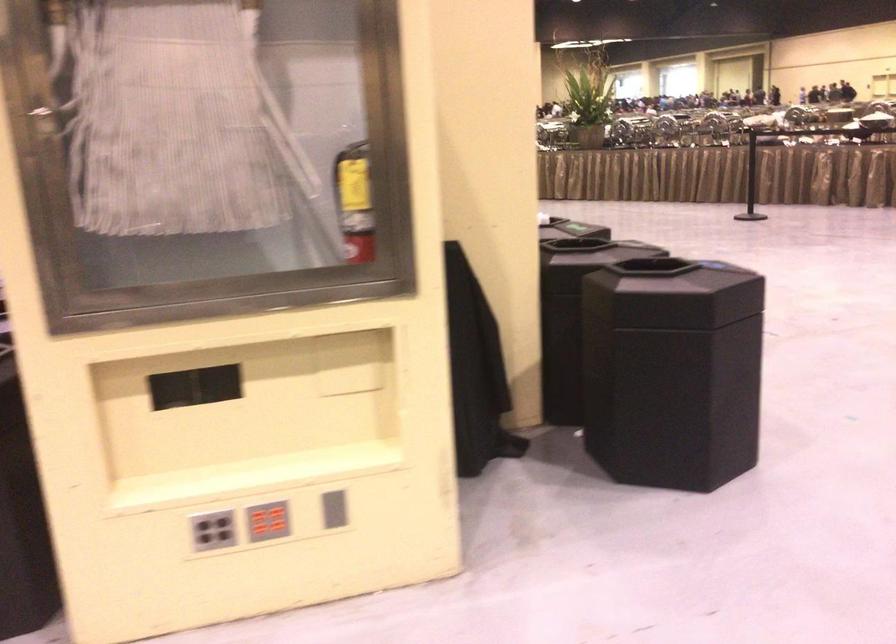
Image resolution: width=896 pixels, height=644 pixels. Describe the element at coordinates (212, 529) in the screenshot. I see `the grey button panel` at that location.